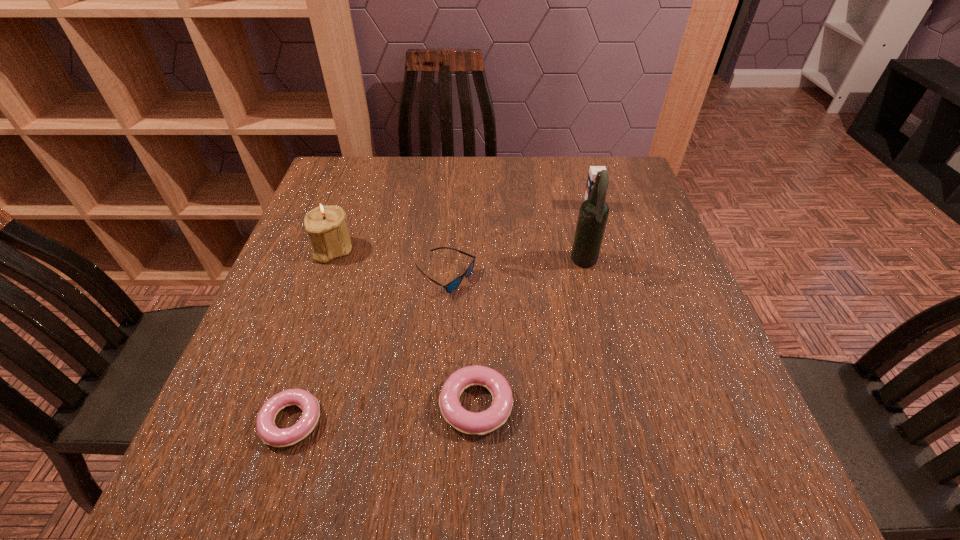
Locate an element on the screen. The height and width of the screenshot is (540, 960). free space between the taller doughnut and the left doughnut is located at coordinates (384, 413).

Identify the location of empty space between the candle_holder and the sunglasses. This screenshot has width=960, height=540. (389, 262).

I want to click on empty space between the left doughnut and the candle_holder, so click(x=312, y=335).

The image size is (960, 540). In order to click on free space that is in between the second object from right to left and the candle_holder in this screenshot , I will do `click(459, 256)`.

Find the location of a particular element. This screenshot has width=960, height=540. vacant area that lies between the second object from right to left and the taller doughnut is located at coordinates coord(530,334).

Image resolution: width=960 pixels, height=540 pixels. Identify the location of empty location between the third tallest object and the sunglasses. (518, 241).

Choose which object is the fifth nearest neighbor to the farthest object. Please provide its 2D coordinates. Your answer should be formatted as a tuple, i.e. [(x, y)], where the tuple contains the x and y coordinates of a point satisfying the conditions above.

[(270, 434)]

I want to click on object that ranks as the closest to the tallest object, so click(x=593, y=170).

Locate an element on the screen. This screenshot has width=960, height=540. free spot that satisfies the following two spatial constraints: 1. on the front side of the shorter doughnut; 2. on the left side of the candle_holder is located at coordinates (272, 422).

Where is `vacant region that satisfies the following two spatial constraints: 1. on the back side of the taller doughnut; 2. on the left side of the left doughnut`? This screenshot has width=960, height=540. vacant region that satisfies the following two spatial constraints: 1. on the back side of the taller doughnut; 2. on the left side of the left doughnut is located at coordinates (297, 405).